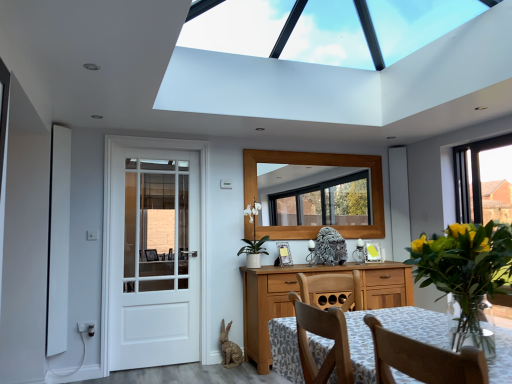
Question: From a real-world perspective, is white painted wood door at left on top of wooden table at center?

Choices:
 (A) no
 (B) yes

Answer: (B)

Question: Does white painted wood door at left have a lesser height compared to wooden table at center?

Choices:
 (A) no
 (B) yes

Answer: (A)

Question: From the image's perspective, is white painted wood door at left on wooden table at center?

Choices:
 (A) yes
 (B) no

Answer: (A)

Question: Does white painted wood door at left have a greater width compared to wooden table at center?

Choices:
 (A) no
 (B) yes

Answer: (A)

Question: Does white painted wood door at left have a smaller size compared to wooden table at center?

Choices:
 (A) yes
 (B) no

Answer: (B)

Question: Is white painted wood door at left oriented away from wooden table at center?

Choices:
 (A) yes
 (B) no

Answer: (B)

Question: Is wooden table at center positioned beyond the bounds of wooden frame mirror at center?

Choices:
 (A) no
 (B) yes

Answer: (B)

Question: From the image's perspective, would you say wooden table at center is shown under wooden frame mirror at center?

Choices:
 (A) no
 (B) yes

Answer: (B)

Question: Is wooden table at center positioned before wooden frame mirror at center?

Choices:
 (A) yes
 (B) no

Answer: (A)

Question: Can you confirm if wooden table at center is shorter than wooden frame mirror at center?

Choices:
 (A) no
 (B) yes

Answer: (B)

Question: Considering the relative positions of wooden table at center and wooden frame mirror at center in the image provided, is wooden table at center to the left of wooden frame mirror at center from the viewer's perspective?

Choices:
 (A) yes
 (B) no

Answer: (A)

Question: Considering the relative sizes of wooden table at center and wooden frame mirror at center in the image provided, is wooden table at center wider than wooden frame mirror at center?

Choices:
 (A) yes
 (B) no

Answer: (A)

Question: Is translucent glass vase at right taller than white painted wood door at left?

Choices:
 (A) no
 (B) yes

Answer: (A)